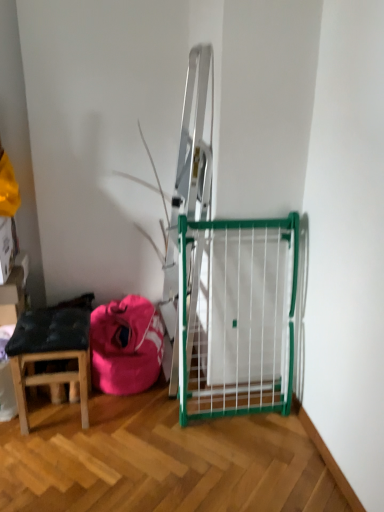
Question: Would you say pink fabric bean bag at lower left is inside or outside wooden stool at lower left?

Choices:
 (A) inside
 (B) outside

Answer: (B)

Question: From a real-world perspective, is pink fabric bean bag at lower left positioned above or below wooden stool at lower left?

Choices:
 (A) above
 (B) below

Answer: (B)

Question: Is pink fabric bean bag at lower left in front of or behind wooden stool at lower left in the image?

Choices:
 (A) behind
 (B) front

Answer: (A)

Question: Considering the positions of wooden stool at lower left and pink fabric bean bag at lower left in the image, is wooden stool at lower left wider or thinner than pink fabric bean bag at lower left?

Choices:
 (A) wide
 (B) thin

Answer: (B)

Question: In terms of height, does wooden stool at lower left look taller or shorter compared to pink fabric bean bag at lower left?

Choices:
 (A) tall
 (B) short

Answer: (A)

Question: In the image, is wooden stool at lower left on the left side or the right side of pink fabric bean bag at lower left?

Choices:
 (A) right
 (B) left

Answer: (B)

Question: From a real-world perspective, is wooden stool at lower left physically located above or below pink fabric bean bag at lower left?

Choices:
 (A) above
 (B) below

Answer: (A)